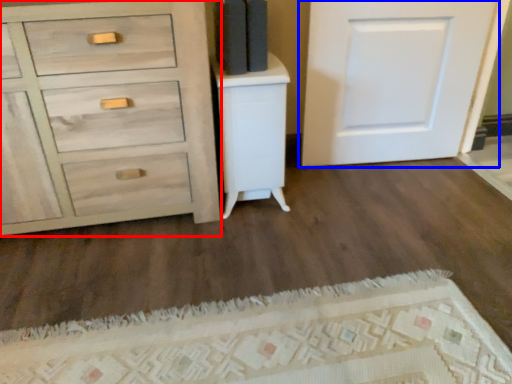
Question: Which object appears farthest to the camera in this image, chest of drawers (highlighted by a red box) or door (highlighted by a blue box)?

Choices:
 (A) chest of drawers
 (B) door

Answer: (B)